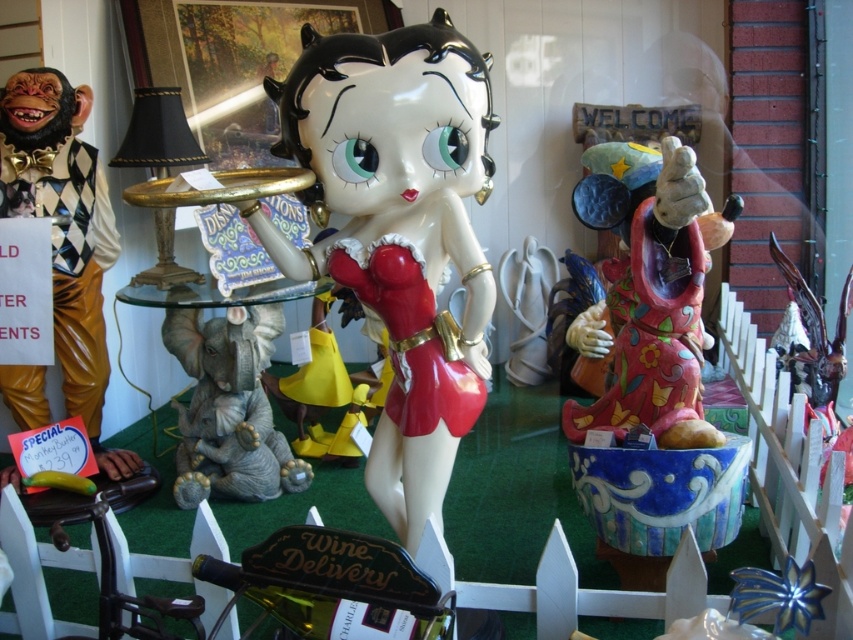
Does point (361, 145) lie in front of point (212, 348)?

Yes, it is.

Measure the distance from glossy ceramic betty boop at center to satin gray elephant at lower left.

glossy ceramic betty boop at center is 36.65 inches away from satin gray elephant at lower left.

Describe the element at coordinates (398, 230) in the screenshot. I see `glossy ceramic betty boop at center` at that location.

Image resolution: width=853 pixels, height=640 pixels. What are the coordinates of `glossy ceramic betty boop at center` in the screenshot? It's located at (398, 230).

Does glossy ceramic betty boop at center have a greater height compared to matte ceramic statue at right?

Indeed, glossy ceramic betty boop at center has a greater height compared to matte ceramic statue at right.

Who is taller, glossy ceramic betty boop at center or matte ceramic statue at right?

Standing taller between the two is glossy ceramic betty boop at center.

This screenshot has width=853, height=640. What do you see at coordinates (398, 230) in the screenshot? I see `glossy ceramic betty boop at center` at bounding box center [398, 230].

You are a GUI agent. You are given a task and a screenshot of the screen. Output one action in this format:
    pyautogui.click(x=<x>, y=<y>)
    Task: Click on the glossy ceramic betty boop at center
    
    Given the screenshot: What is the action you would take?
    pyautogui.click(x=398, y=230)

Which of these two, wooden monkey at left or satin gray elephant at lower left, stands shorter?

With less height is satin gray elephant at lower left.

Can you confirm if wooden monkey at left is positioned to the left of satin gray elephant at lower left?

Correct, you'll find wooden monkey at left to the left of satin gray elephant at lower left.

Where is `wooden monkey at left`? The width and height of the screenshot is (853, 640). wooden monkey at left is located at coordinates (x=67, y=232).